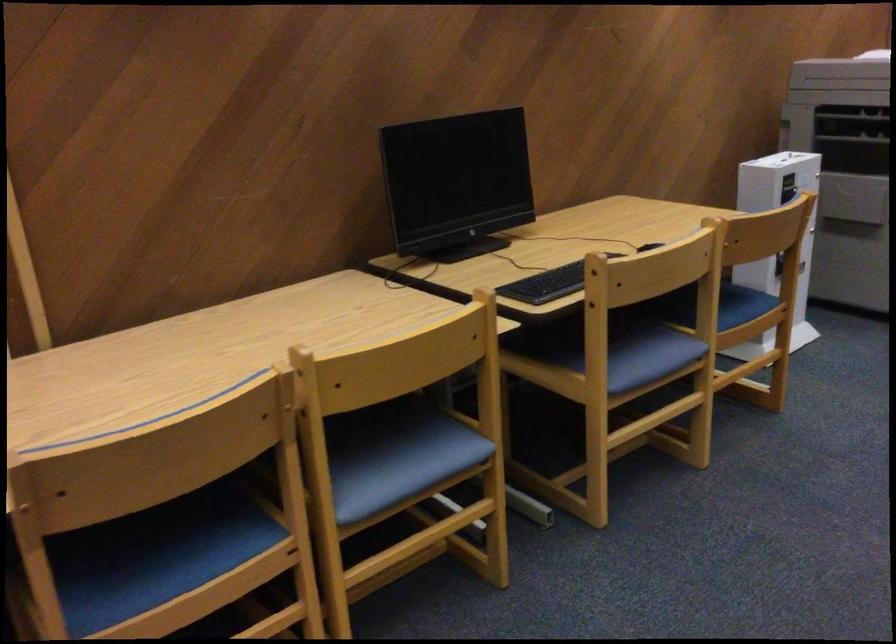
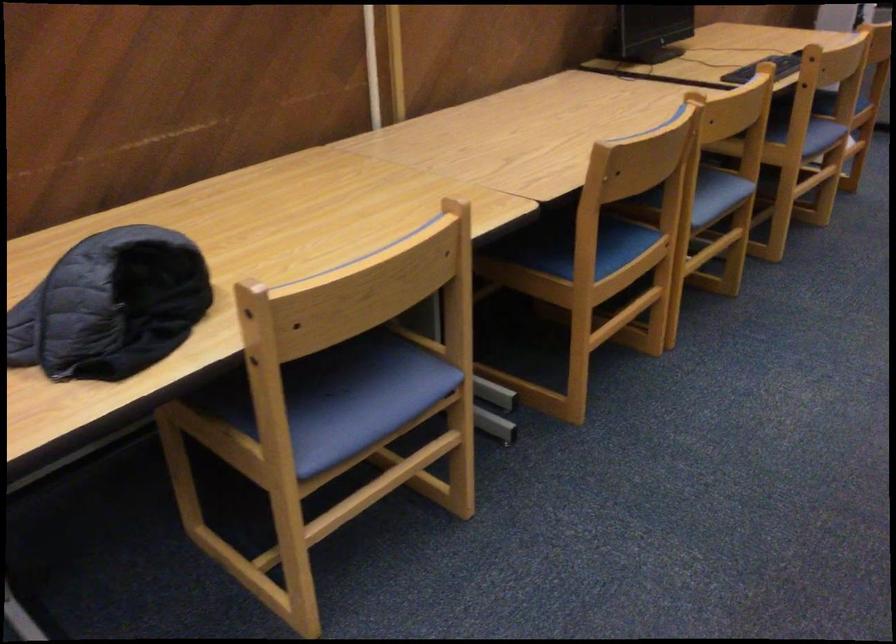
Locate, in the second image, the point that corresponds to point (177, 558) in the first image.

(597, 248)